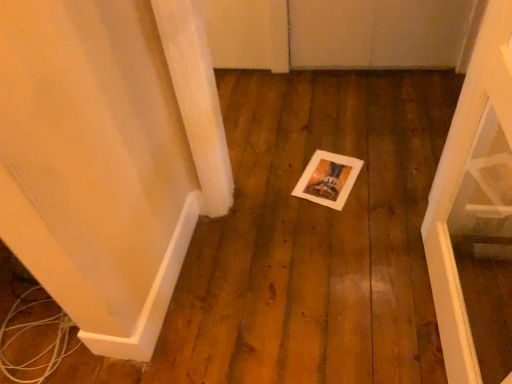
Question: Considering the relative positions of white wood door at right and white paper postcard at center in the image provided, is white wood door at right to the left or to the right of white paper postcard at center?

Choices:
 (A) right
 (B) left

Answer: (A)

Question: Is white wood door at right spatially inside white paper postcard at center, or outside of it?

Choices:
 (A) inside
 (B) outside

Answer: (B)

Question: From a real-world perspective, is white wood door at right above or below white paper postcard at center?

Choices:
 (A) above
 (B) below

Answer: (A)

Question: Is white paper postcard at center bigger or smaller than white wood door at right?

Choices:
 (A) big
 (B) small

Answer: (B)

Question: From a real-world perspective, relative to white wood door at right, is white paper postcard at center vertically above or below?

Choices:
 (A) above
 (B) below

Answer: (B)

Question: From the image's perspective, is white paper postcard at center positioned above or below white wood door at right?

Choices:
 (A) above
 (B) below

Answer: (A)

Question: Does point (308, 167) appear closer or farther from the camera than point (436, 269)?

Choices:
 (A) farther
 (B) closer

Answer: (A)